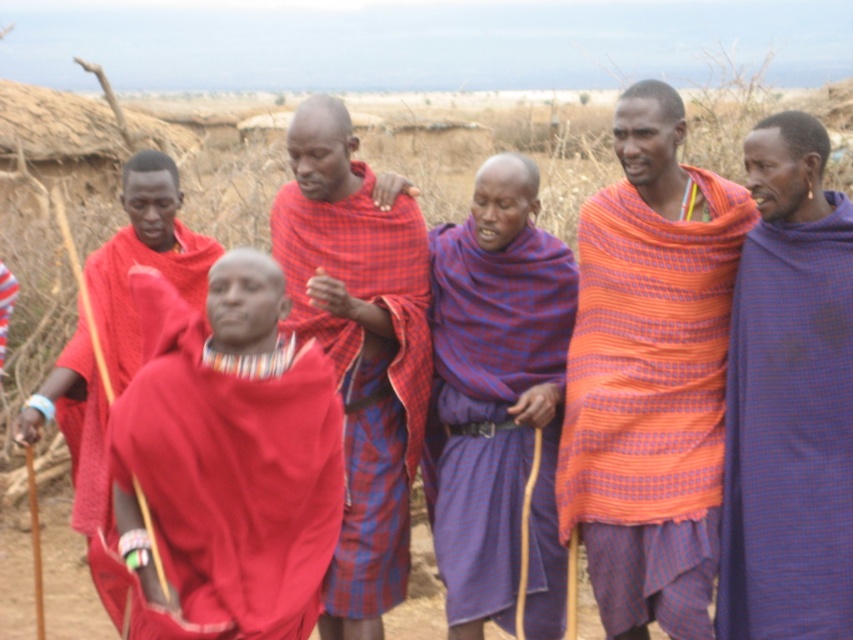
Looking at this image, does blue plaid shawl at center have a lesser height compared to matte red shawl at left?

No.

Is blue plaid shawl at center thinner than matte red shawl at left?

Indeed, blue plaid shawl at center has a lesser width compared to matte red shawl at left.

Who is more forward, (492, 291) or (201, 234)?

Point (492, 291)

Identify the location of blue plaid shawl at center. pyautogui.click(x=498, y=401).

Who is taller, matte red shawl at center or matte red shawl at left?

With more height is matte red shawl at center.

Does matte red shawl at center appear on the left side of matte red shawl at left?

No, matte red shawl at center is not to the left of matte red shawl at left.

You are a GUI agent. You are given a task and a screenshot of the screen. Output one action in this format:
    pyautogui.click(x=<x>, y=<y>)
    Task: Click on the matte red shawl at center
    This screenshot has width=853, height=640.
    Given the screenshot: What is the action you would take?
    pyautogui.click(x=227, y=458)

Is blue woven cloth at center below red plaid shawl at center?

Yes, blue woven cloth at center is below red plaid shawl at center.

The image size is (853, 640). Describe the element at coordinates (788, 400) in the screenshot. I see `blue woven cloth at center` at that location.

Locate an element on the screen. blue woven cloth at center is located at coordinates (788, 400).

Find the location of a particular element. blue woven cloth at center is located at coordinates (788, 400).